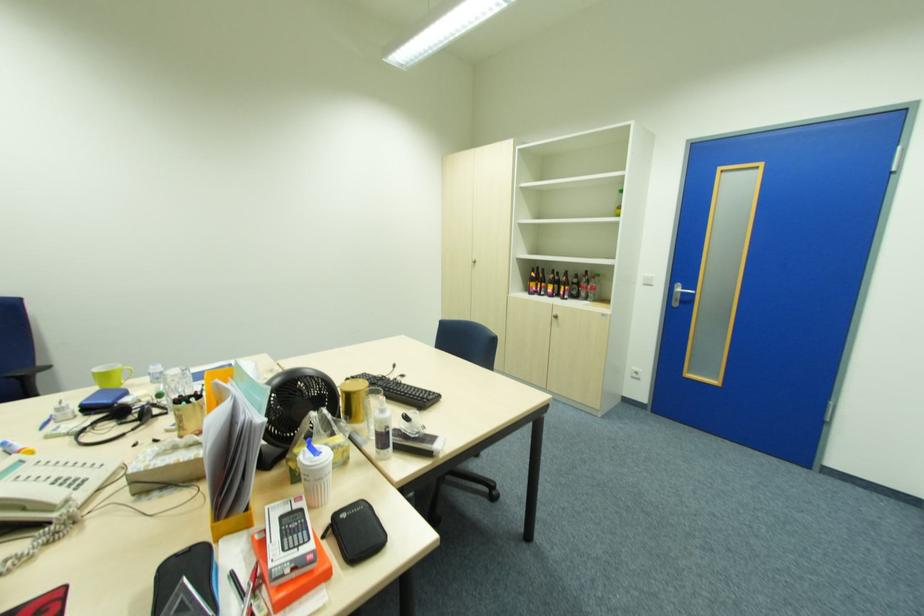
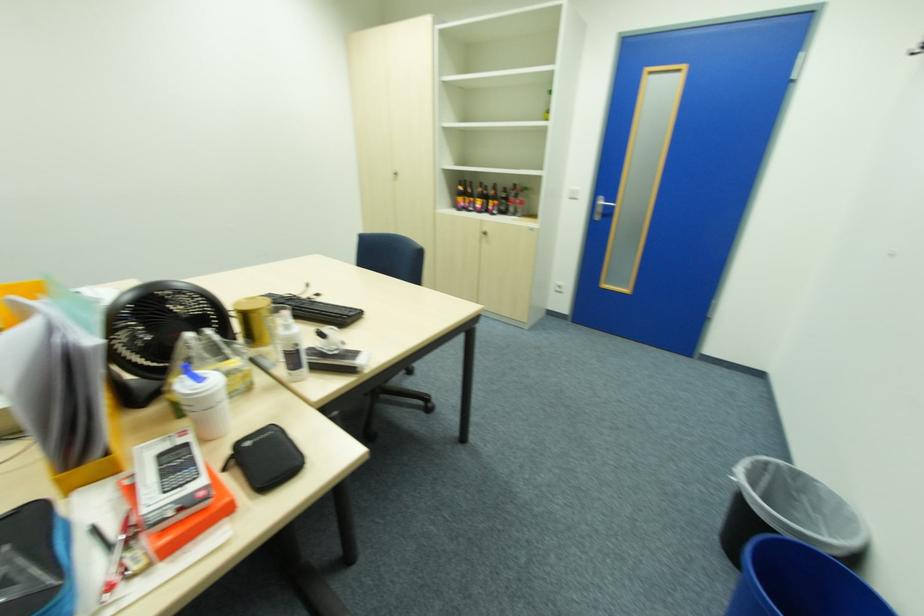
Question: Which direction would the cameraman need to move to produce the second image? Reply with the corresponding letter.

Choices:
 (A) Left
 (B) Right
 (C) Forward
 (D) Backward

Answer: (C)